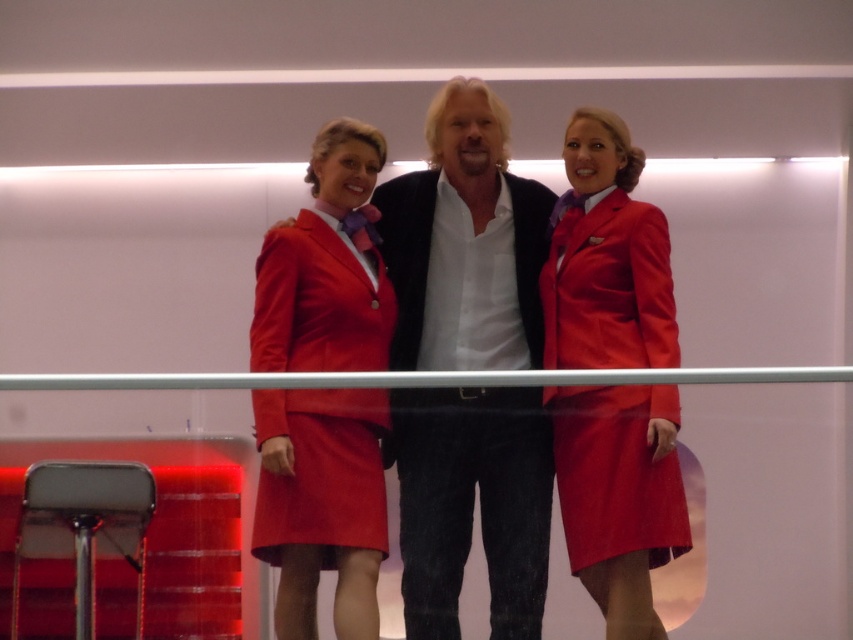
What do you see at coordinates (606, 259) in the screenshot?
I see `matte red uniform at right` at bounding box center [606, 259].

Does matte red uniform at right appear under matte black shirt at center?

Incorrect, matte red uniform at right is not positioned below matte black shirt at center.

Is point (546, 298) behind point (419, 177)?

That is False.

At what (x,y) coordinates should I click in order to perform the action: click on matte red uniform at right. Please return your answer as a coordinate pair (x, y). Looking at the image, I should click on [606, 259].

Between matte red uniform at center and matte black shirt at center, which one has less height?

Standing shorter between the two is matte black shirt at center.

Image resolution: width=853 pixels, height=640 pixels. What do you see at coordinates (465, 243) in the screenshot?
I see `matte red uniform at center` at bounding box center [465, 243].

Where is `matte red uniform at center`? matte red uniform at center is located at coordinates (465, 243).

Which is behind, point (645, 209) or point (358, 417)?

The point (645, 209) is more distant.

Is matte red uniform at right smaller than matte red dress at center?

No, matte red uniform at right is not smaller than matte red dress at center.

Identify the location of matte red uniform at right. (606, 259).

This screenshot has width=853, height=640. I want to click on matte red uniform at right, so click(606, 259).